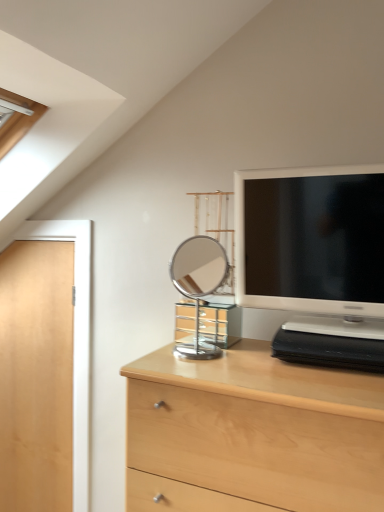
Question: Are matte white television at upper right and polished chrome mirror at center beside each other?

Choices:
 (A) yes
 (B) no

Answer: (B)

Question: Is matte white television at upper right facing towards polished chrome mirror at center?

Choices:
 (A) yes
 (B) no

Answer: (B)

Question: Is matte white television at upper right at the right side of polished chrome mirror at center?

Choices:
 (A) yes
 (B) no

Answer: (A)

Question: Is matte white television at upper right positioned in front of polished chrome mirror at center?

Choices:
 (A) no
 (B) yes

Answer: (B)

Question: Is matte white television at upper right behind polished chrome mirror at center?

Choices:
 (A) no
 (B) yes

Answer: (A)

Question: From a real-world perspective, is matte white television at upper right located beneath polished chrome mirror at center?

Choices:
 (A) no
 (B) yes

Answer: (A)

Question: Is matte white television at upper right aimed at light wood chest of drawers at center?

Choices:
 (A) yes
 (B) no

Answer: (B)

Question: Is matte white television at upper right taller than light wood chest of drawers at center?

Choices:
 (A) yes
 (B) no

Answer: (B)

Question: Is matte white television at upper right directly adjacent to light wood chest of drawers at center?

Choices:
 (A) yes
 (B) no

Answer: (B)

Question: Is matte white television at upper right not close to light wood chest of drawers at center?

Choices:
 (A) yes
 (B) no

Answer: (B)

Question: From the image's perspective, is matte white television at upper right located beneath light wood chest of drawers at center?

Choices:
 (A) no
 (B) yes

Answer: (A)

Question: Is matte white television at upper right positioned beyond the bounds of light wood chest of drawers at center?

Choices:
 (A) yes
 (B) no

Answer: (A)

Question: Considering the relative sizes of light wood chest of drawers at center and light wood door at left in the image provided, is light wood chest of drawers at center bigger than light wood door at left?

Choices:
 (A) yes
 (B) no

Answer: (A)